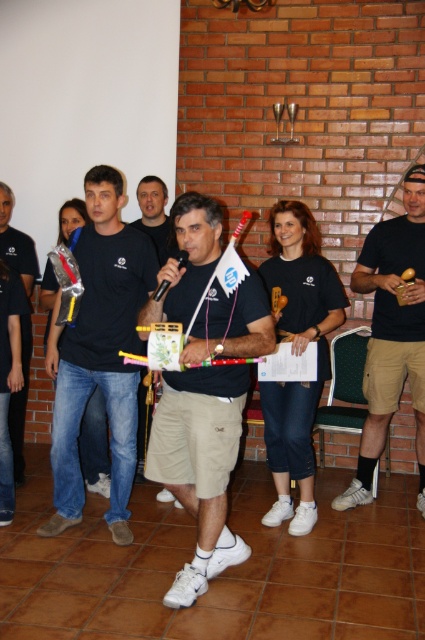
Find the location of `black cotton shirt at center`. black cotton shirt at center is located at coordinates (99, 353).

You are a GUI agent. You are given a task and a screenshot of the screen. Output one action in this format:
    pyautogui.click(x=<x>, y=<y>)
    Task: Click on the black cotton shirt at center
    Image resolution: width=425 pixels, height=640 pixels.
    Given the screenshot: What is the action you would take?
    pyautogui.click(x=99, y=353)

Locate an element on the screen. The width and height of the screenshot is (425, 640). matte khaki shorts at center is located at coordinates (200, 465).

Can you confirm if matte khaki shorts at center is positioned to the right of black cotton shirt at center?

Indeed, matte khaki shorts at center is positioned on the right side of black cotton shirt at center.

Which is behind, point (232, 381) or point (74, 460)?

The point (74, 460) is behind.

The height and width of the screenshot is (640, 425). Identify the location of matte khaki shorts at center. (200, 465).

How far apart are black cotton shirt at center and matte black shirt at center?

36.67 inches

Can you confirm if black cotton shirt at center is positioned to the left of matte black shirt at center?

Yes, black cotton shirt at center is to the left of matte black shirt at center.

Identify the location of black cotton shirt at center. (99, 353).

At what (x,y) coordinates should I click in order to perform the action: click on black cotton shirt at center. Please return your answer as a coordinate pair (x, y). Looking at the image, I should click on (99, 353).